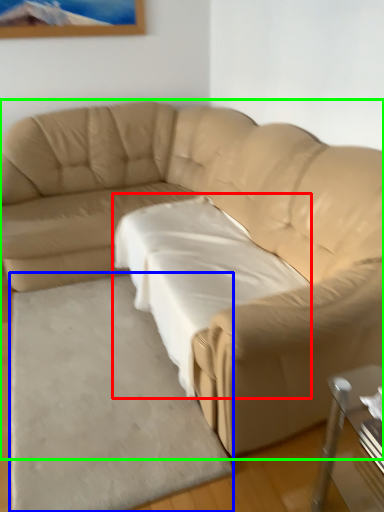
Question: Considering the real-world distances, which object is farthest from sheet (highlighted by a red box)? mat (highlighted by a blue box) or studio couch (highlighted by a green box)?

Choices:
 (A) mat
 (B) studio couch

Answer: (A)